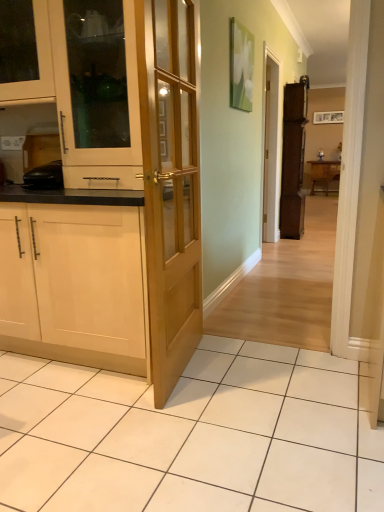
Question: From the image's perspective, would you say brown wooden cabinet at right, which ranks as the 4th cabinetry in front-to-back order, is shown under wooden table at right?

Choices:
 (A) yes
 (B) no

Answer: (A)

Question: Can you confirm if brown wooden cabinet at right, the fourth cabinetry from the left, is thinner than wooden table at right?

Choices:
 (A) no
 (B) yes

Answer: (B)

Question: From the image's perspective, is brown wooden cabinet at right, which is the first cabinetry in right-to-left order, over wooden table at right?

Choices:
 (A) yes
 (B) no

Answer: (B)

Question: Would you say brown wooden cabinet at right, marked as the first cabinetry in a back-to-front arrangement, is outside wooden table at right?

Choices:
 (A) no
 (B) yes

Answer: (B)

Question: Is brown wooden cabinet at right, which is the first cabinetry in right-to-left order, in contact with wooden table at right?

Choices:
 (A) no
 (B) yes

Answer: (A)

Question: Is the depth of brown wooden cabinet at right, which ranks as the 4th cabinetry in front-to-back order, greater than that of wooden table at right?

Choices:
 (A) no
 (B) yes

Answer: (A)

Question: Considering the relative sizes of white wood cabinet at left, placed as the third cabinetry when sorted from left to right, and brown wooden cabinet at right, the fourth cabinetry from the left, in the image provided, is white wood cabinet at left, placed as the third cabinetry when sorted from left to right, shorter than brown wooden cabinet at right, the fourth cabinetry from the left,?

Choices:
 (A) yes
 (B) no

Answer: (A)

Question: Is white wood cabinet at left, placed as the third cabinetry when sorted from left to right, at the left side of brown wooden cabinet at right, the fourth cabinetry from the left?

Choices:
 (A) no
 (B) yes

Answer: (B)

Question: Is white wood cabinet at left, the 3th cabinetry when ordered from back to front, positioned before brown wooden cabinet at right, which ranks as the 4th cabinetry in front-to-back order?

Choices:
 (A) no
 (B) yes

Answer: (B)

Question: Is white wood cabinet at left, the 3th cabinetry when ordered from back to front, aimed at brown wooden cabinet at right, which is the first cabinetry in right-to-left order?

Choices:
 (A) yes
 (B) no

Answer: (B)

Question: Considering the relative sizes of white wood cabinet at left, the 2th cabinetry in the front-to-back sequence, and brown wooden cabinet at right, which is the first cabinetry in right-to-left order, in the image provided, is white wood cabinet at left, the 2th cabinetry in the front-to-back sequence, thinner than brown wooden cabinet at right, which is the first cabinetry in right-to-left order,?

Choices:
 (A) no
 (B) yes

Answer: (A)

Question: From the image's perspective, would you say white wood cabinet at left, placed as the third cabinetry when sorted from left to right, is shown under brown wooden cabinet at right, marked as the first cabinetry in a back-to-front arrangement?

Choices:
 (A) no
 (B) yes

Answer: (B)

Question: Is wooden table at right oriented away from white wood cabinet at left, the 3th cabinetry when ordered from back to front?

Choices:
 (A) yes
 (B) no

Answer: (B)